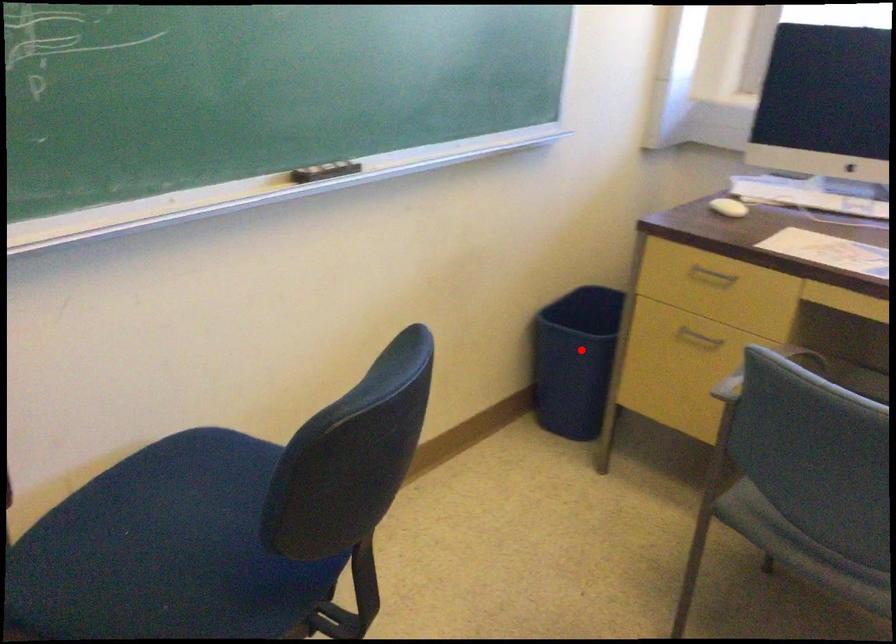
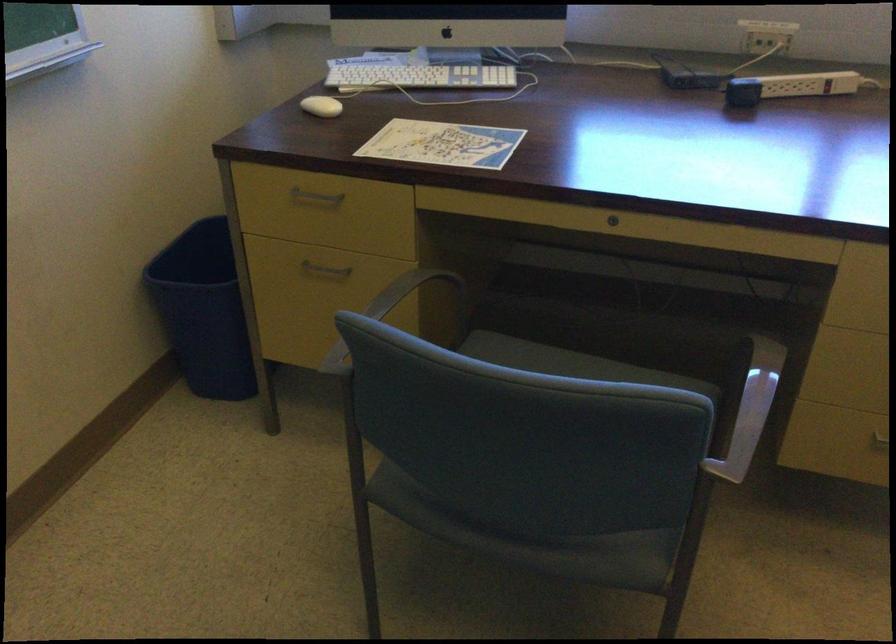
Question: A red point is marked in image1. In image2, is the corresponding 3D point closer to the camera or farther? Reply with the corresponding letter.

Choices:
 (A) The corresponding 3D point is closer.
 (B) The corresponding 3D point is farther.

Answer: (A)